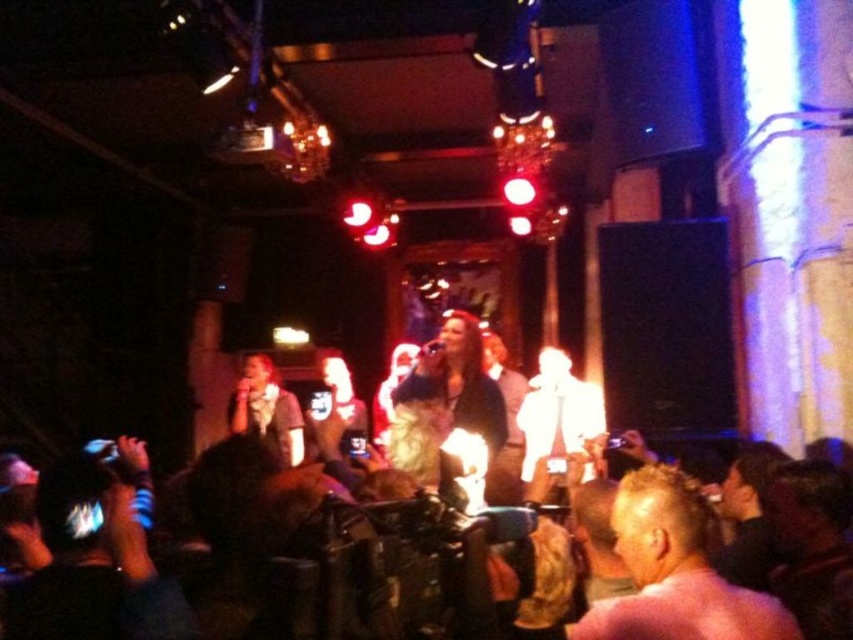
You are a photographer at the event and need to capture a photo that includes both the shiny gold jacket at center and the matte gray shirt at center. Based on their positions, which one should you focus on first to ensure both are in frame?

The shiny gold jacket at center is to the right of the matte gray shirt at center, so you should focus on the matte gray shirt at center first to ensure both are in frame.

You are a photographer at the live music venue and want to capture a shot of both the white glossy microphone at center and the matte gray shirt at center. Since you can only focus on one object at a time, which one should you focus on first if you want to ensure the other is also in the frame?

The white glossy microphone at center is to the right of matte gray shirt at center. Since the microphone is positioned to the right, you should focus on the matte gray shirt at center first, as it is closer to the center and the microphone will naturally fall into the frame to its right.